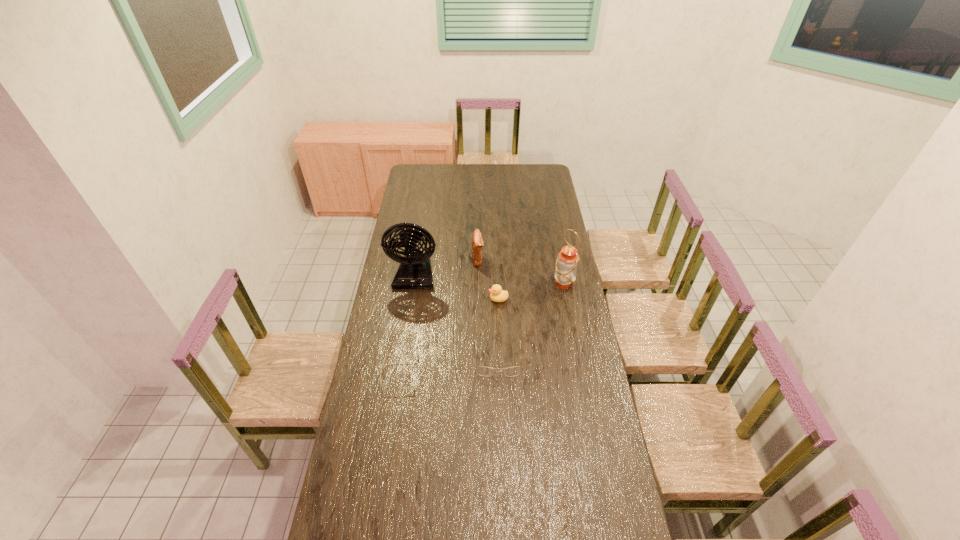
The image size is (960, 540). I want to click on free area in between the oil lamp and the shortest object, so click(x=482, y=329).

Locate an element on the screen. free space between the shortest object and the oil lamp is located at coordinates (482, 329).

Locate an element on the screen. The width and height of the screenshot is (960, 540). the fourth closest object to the rightmost object is located at coordinates (414, 272).

Locate which object ranks second in proximity to the rightmost object. Please provide its 2D coordinates. Your answer should be formatted as a tuple, i.e. [(x, y)], where the tuple contains the x and y coordinates of a point satisfying the conditions above.

[(477, 242)]

Where is `vacant position in the image that satisfies the following two spatial constraints: 1. in front of the fan to blow air; 2. on the left side of the oil lamp`? This screenshot has width=960, height=540. vacant position in the image that satisfies the following two spatial constraints: 1. in front of the fan to blow air; 2. on the left side of the oil lamp is located at coordinates (414, 284).

You are a GUI agent. You are given a task and a screenshot of the screen. Output one action in this format:
    pyautogui.click(x=<x>, y=<y>)
    Task: Click on the vacant space that satisfies the following two spatial constraints: 1. in front of the rightmost object to blow air; 2. on the right side of the fan
    This screenshot has width=960, height=540.
    Given the screenshot: What is the action you would take?
    pyautogui.click(x=414, y=284)

Identify the location of free location that satisfies the following two spatial constraints: 1. on the front side of the rightmost object; 2. on the face of the duckling. The image size is (960, 540). (566, 299).

At what (x,y) coordinates should I click in order to perform the action: click on free spot that satisfies the following two spatial constraints: 1. on the open side of the third tallest object; 2. in front of the fan to blow air. Please return your answer as a coordinate pair (x, y). Looking at the image, I should click on (478, 275).

The height and width of the screenshot is (540, 960). I want to click on free location that satisfies the following two spatial constraints: 1. on the front-facing side of the right spectacles; 2. on the front-facing side of the shorter spectacles, so click(499, 376).